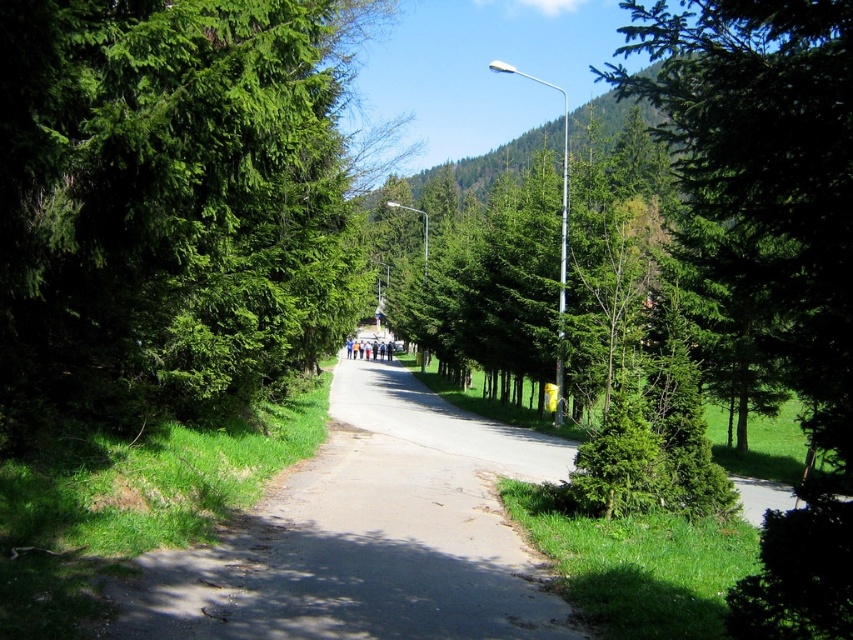
Question: Among these points, which one is nearest to the camera?

Choices:
 (A) (746, 84)
 (B) (469, 490)

Answer: (A)

Question: Which of these objects is positioned closest to the smooth asphalt road at center?

Choices:
 (A) green glossy tree at right
 (B) green leafy tree at center
 (C) light blue jeans at center

Answer: (B)

Question: Does green leafy tree at center have a lesser width compared to light blue jeans at center?

Choices:
 (A) yes
 (B) no

Answer: (A)

Question: Which of the following is the farthest from the observer?

Choices:
 (A) smooth asphalt road at center
 (B) green glossy tree at right
 (C) light blue jeans at center
 (D) green leafy tree at center

Answer: (C)

Question: Does green leafy tree at center have a lesser width compared to smooth asphalt road at center?

Choices:
 (A) no
 (B) yes

Answer: (B)

Question: Can you confirm if green leafy tree at center is positioned to the left of green glossy tree at right?

Choices:
 (A) yes
 (B) no

Answer: (A)